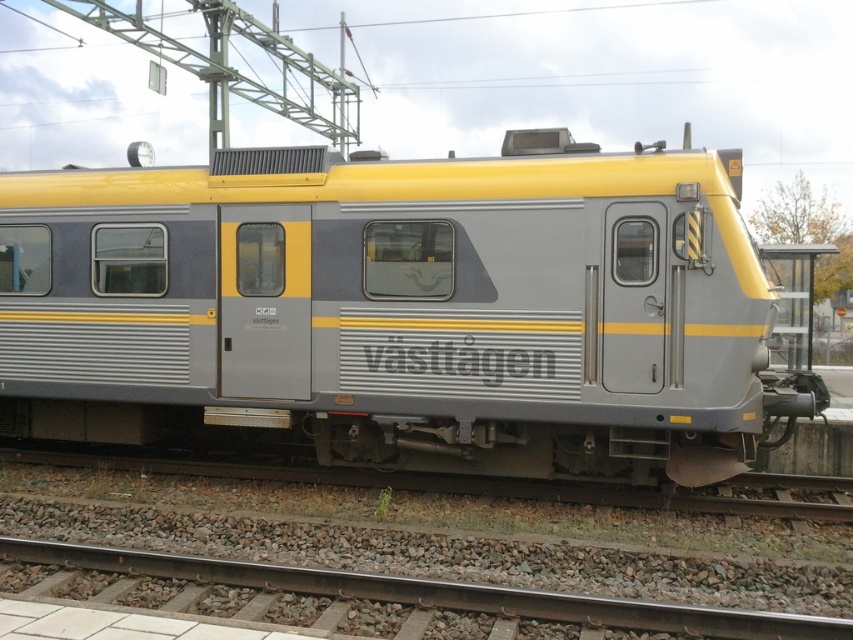
In the scene shown: You are standing on the platform and see the point marked at coordinates (402, 308). What object is located at that point?

The metallic gray train at center is located at point (402, 308).